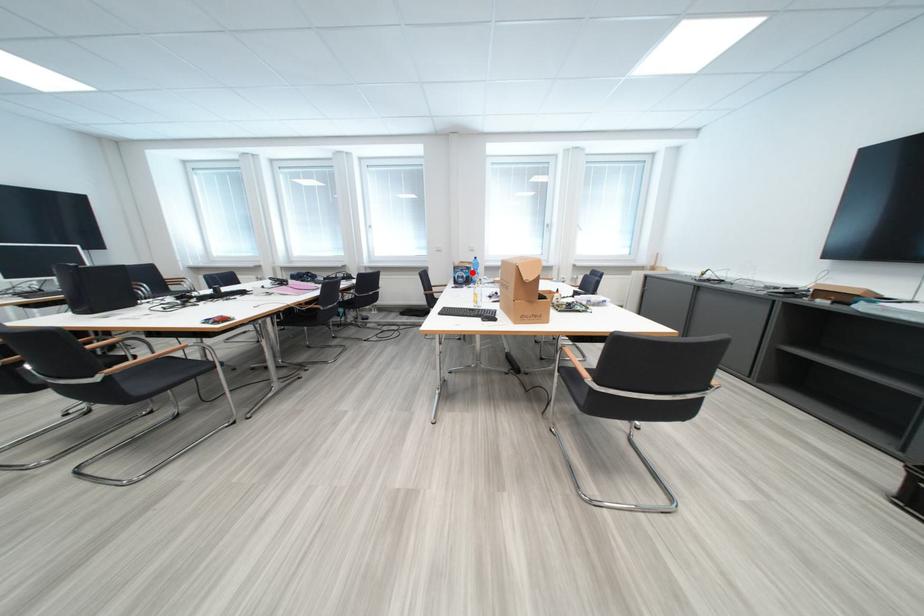
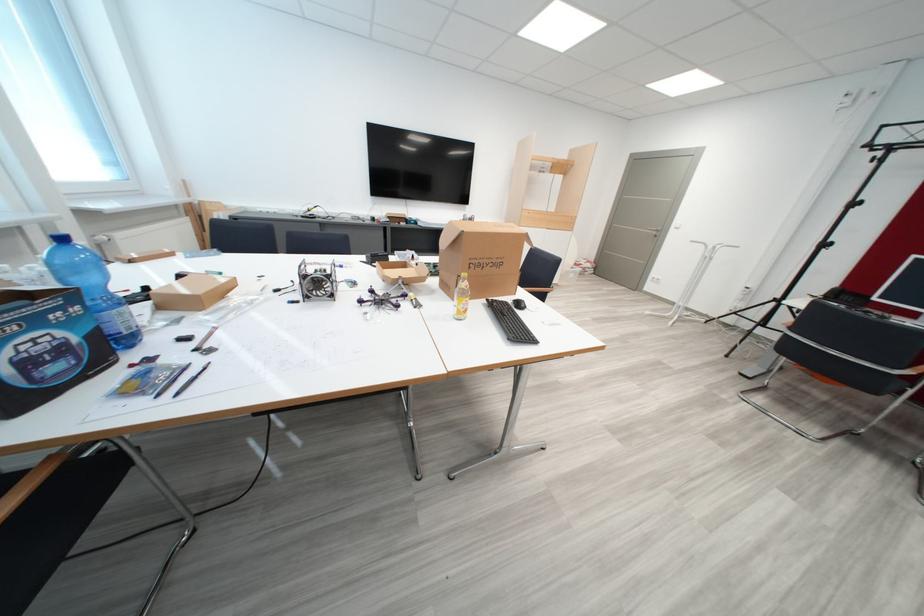
Question: I am providing you with two images of the same scene from different viewpoints. Image1 has a red point marked. In image2, the corresponding 3D location appears at what relative position? Reply with the corresponding letter.

Choices:
 (A) Closer
 (B) Farther

Answer: (B)